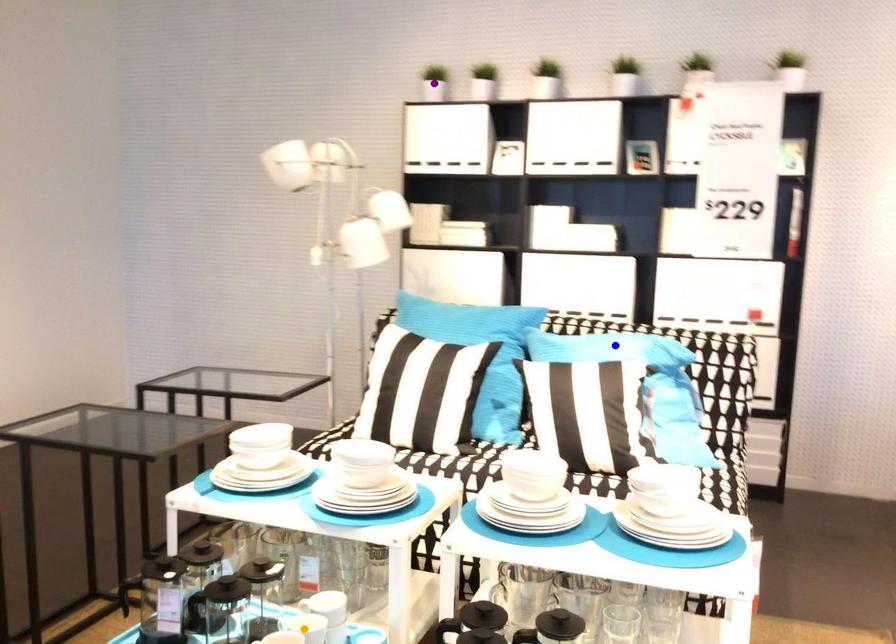
Order these from nearest to farthest:
purple point, orange point, blue point

orange point, blue point, purple point